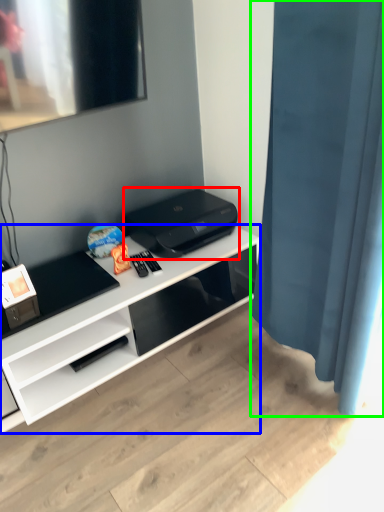
Question: Which object is the closest to the printer (highlighted by a red box)? Choose among these: desk (highlighted by a blue box) or shower curtain (highlighted by a green box).

Choices:
 (A) desk
 (B) shower curtain

Answer: (A)